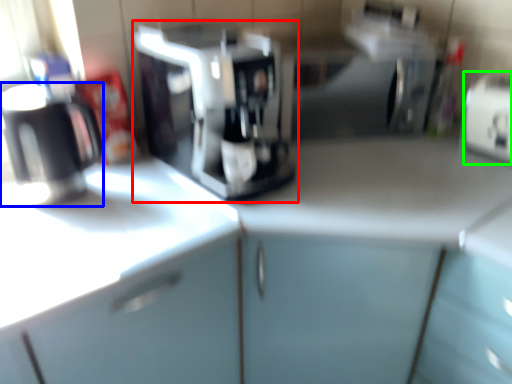
Question: Which object is the farthest from coffee maker (highlighted by a red box)? Choose among these: kitchen appliance (highlighted by a blue box) or appliance (highlighted by a green box).

Choices:
 (A) kitchen appliance
 (B) appliance

Answer: (B)